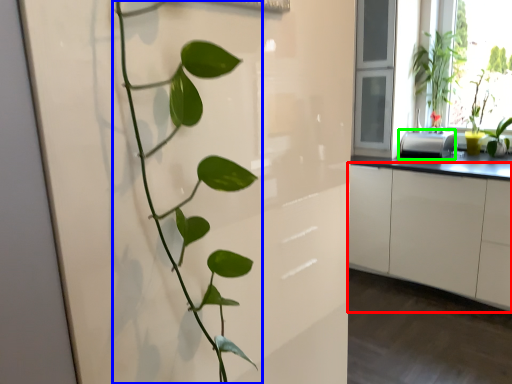
Question: Estimate the real-world distances between objects in this image. Which object is closer to cabinetry (highlighted by a red box), houseplant (highlighted by a blue box) or appliance (highlighted by a green box)?

Choices:
 (A) houseplant
 (B) appliance

Answer: (B)